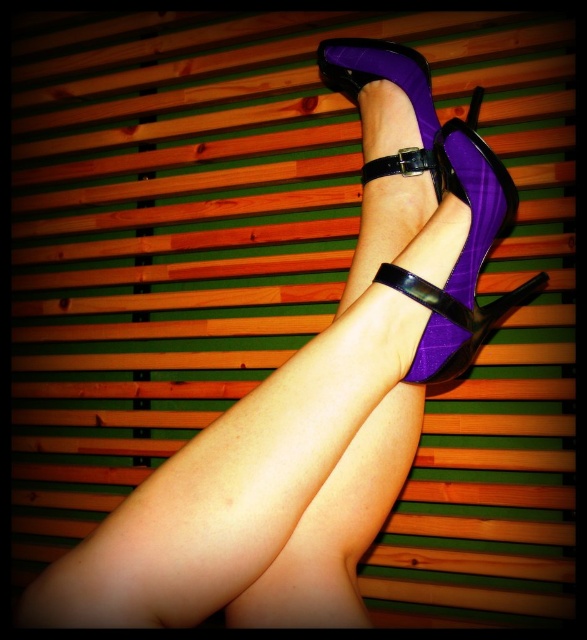
You are a fashion stylist preparing for a photoshoot. You notice two purple suede shoes in the image. Which one is positioned lower between the purple suede heels at center and the purple suede sandal at center?

The purple suede heels at center is located below the purple suede sandal at center, so it is positioned lower.

You are trying to decide which shoe to wear for a narrow hallway. You have the purple suede heels at center and the purple suede sandal at center. Based on their widths, which one is more likely to fit through a narrow space?

The purple suede sandal at center is more likely to fit through a narrow space since it might be narrower than the purple suede heels at center according to the description.